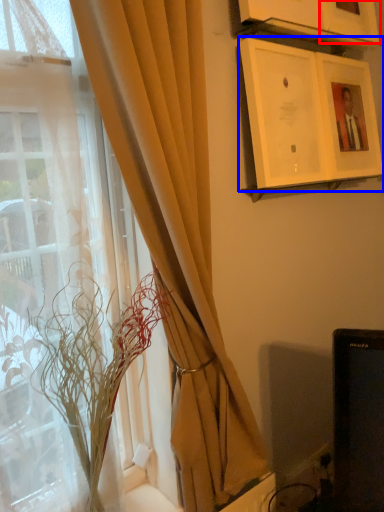
Question: Which object is further to the camera taking this photo, picture frame (highlighted by a red box) or picture frame (highlighted by a blue box)?

Choices:
 (A) picture frame
 (B) picture frame

Answer: (A)